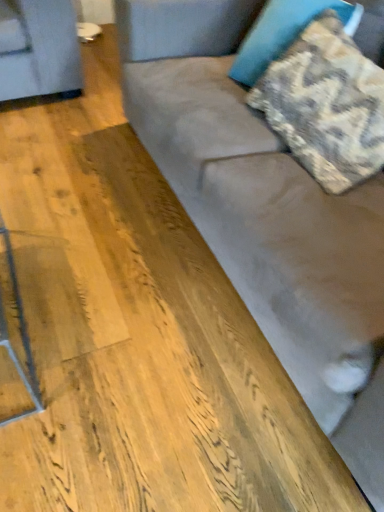
Question: Is camouflage fabric pillow at upper right, which is the second pillow from bottom to top, directly adjacent to textured beige pillow at upper right, positioned as the 2th pillow in top-to-bottom order?

Choices:
 (A) no
 (B) yes

Answer: (A)

Question: Does camouflage fabric pillow at upper right, which appears as the first pillow when viewed from the top, have a greater height compared to textured beige pillow at upper right, positioned as the 2th pillow in top-to-bottom order?

Choices:
 (A) yes
 (B) no

Answer: (A)

Question: Considering the relative positions of camouflage fabric pillow at upper right, which appears as the first pillow when viewed from the top, and textured beige pillow at upper right, positioned as the 2th pillow in top-to-bottom order, in the image provided, is camouflage fabric pillow at upper right, which appears as the first pillow when viewed from the top, to the left of textured beige pillow at upper right, positioned as the 2th pillow in top-to-bottom order, from the viewer's perspective?

Choices:
 (A) no
 (B) yes

Answer: (B)

Question: Is camouflage fabric pillow at upper right, which is the second pillow from bottom to top, further to camera compared to textured beige pillow at upper right, positioned as the 2th pillow in top-to-bottom order?

Choices:
 (A) yes
 (B) no

Answer: (A)

Question: Is camouflage fabric pillow at upper right, which is the second pillow from bottom to top, facing away from textured beige pillow at upper right, which is the 1th pillow in bottom-to-top order?

Choices:
 (A) no
 (B) yes

Answer: (A)

Question: Is textured beige pillow at upper right, positioned as the 2th pillow in top-to-bottom order, surrounded by camouflage fabric pillow at upper right, which appears as the first pillow when viewed from the top?

Choices:
 (A) yes
 (B) no

Answer: (B)

Question: Is textured beige pillow at upper right, which is the 1th pillow in bottom-to-top order, placed right next to suede couch at center?

Choices:
 (A) yes
 (B) no

Answer: (B)

Question: Is suede couch at center surrounded by textured beige pillow at upper right, positioned as the 2th pillow in top-to-bottom order?

Choices:
 (A) yes
 (B) no

Answer: (B)

Question: Is textured beige pillow at upper right, positioned as the 2th pillow in top-to-bottom order, completely or partially outside of suede couch at center?

Choices:
 (A) yes
 (B) no

Answer: (B)

Question: Does textured beige pillow at upper right, positioned as the 2th pillow in top-to-bottom order, have a larger size compared to suede couch at center?

Choices:
 (A) yes
 (B) no

Answer: (B)

Question: Can you confirm if textured beige pillow at upper right, which is the 1th pillow in bottom-to-top order, is thinner than suede couch at center?

Choices:
 (A) yes
 (B) no

Answer: (A)

Question: Does textured beige pillow at upper right, which is the 1th pillow in bottom-to-top order, turn towards suede couch at center?

Choices:
 (A) yes
 (B) no

Answer: (A)

Question: From a real-world perspective, does suede couch at center sit lower than camouflage fabric pillow at upper right, which is the second pillow from bottom to top?

Choices:
 (A) no
 (B) yes

Answer: (B)